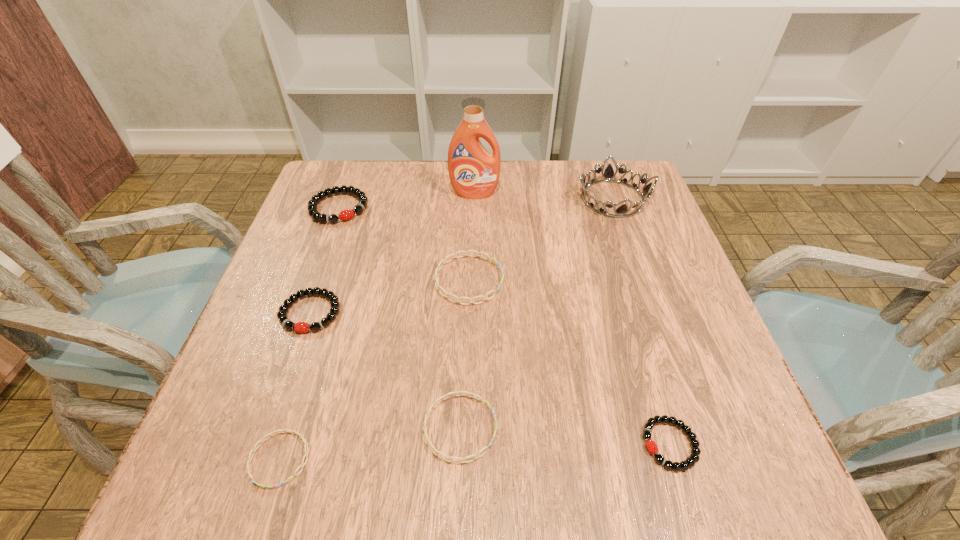
Find the location of a particular element. Image resolution: width=960 pixels, height=540 pixels. the leftmost blue bracelet is located at coordinates (301, 436).

Where is `vacant space located 0.150m on the front-facing side of the detergent`? This screenshot has height=540, width=960. vacant space located 0.150m on the front-facing side of the detergent is located at coordinates (474, 237).

I want to click on free region located on the front-facing side of the tiara, so click(x=455, y=199).

Identify the location of free location located 0.100m on the front-facing side of the tiara. The width and height of the screenshot is (960, 540). (537, 199).

The image size is (960, 540). Find the location of `free location located 0.210m on the front-facing side of the tiara`. free location located 0.210m on the front-facing side of the tiara is located at coordinates (493, 199).

The image size is (960, 540). In order to click on free location located 0.070m on the right of the farthest bracelet in this screenshot , I will do `click(396, 208)`.

Where is `vacant space located on the surface of the farthest blue bracelet showing star-shaped elements`? The image size is (960, 540). vacant space located on the surface of the farthest blue bracelet showing star-shaped elements is located at coordinates (560, 280).

The width and height of the screenshot is (960, 540). I want to click on vacant space positioned on the right of the second nearest black bracelet, so click(x=456, y=312).

Image resolution: width=960 pixels, height=540 pixels. What are the coordinates of `vacant space located on the surface of the second smallest blue bracelet showing star-shaped elements` in the screenshot? It's located at (719, 428).

Find the location of a particular element. vacant space located 0.200m on the left of the rightmost bracelet is located at coordinates (516, 444).